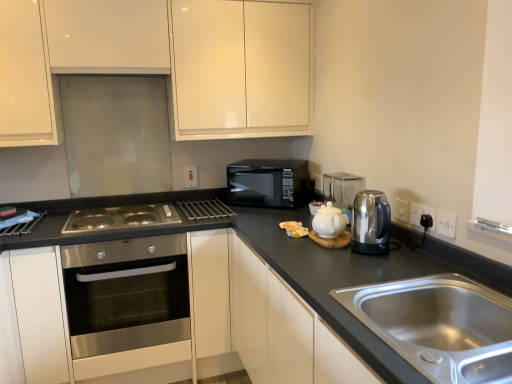
I want to click on vacant space in front of satin metallic kettle at right, the first appliance positioned from the right, so click(x=380, y=274).